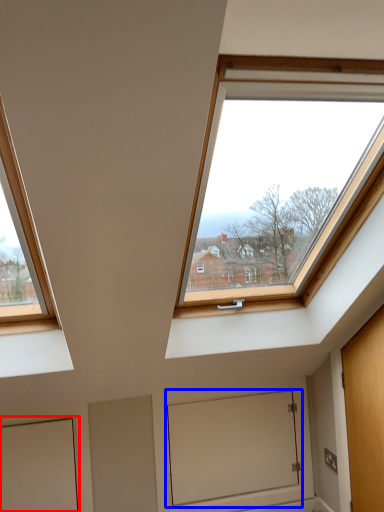
Question: Which object appears farthest to the camera in this image, door (highlighted by a red box) or window screen (highlighted by a blue box)?

Choices:
 (A) door
 (B) window screen

Answer: (B)